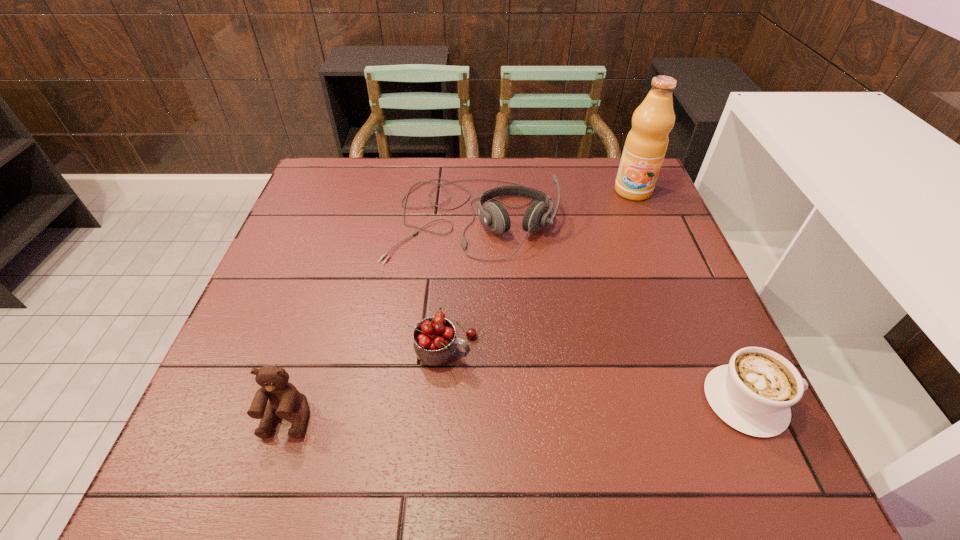
At what (x,y) coordinates should I click in order to perform the action: click on free space at the far right corner of the desktop. Please return your answer as a coordinate pair (x, y). Looking at the image, I should click on (611, 185).

Identify the location of free space at the near right corner of the desktop. The image size is (960, 540). (684, 388).

You are a GUI agent. You are given a task and a screenshot of the screen. Output one action in this format:
    pyautogui.click(x=<x>, y=<y>)
    Task: Click on the empty space between the headset and the leftmost object
    The image size is (960, 540).
    Given the screenshot: What is the action you would take?
    pyautogui.click(x=380, y=318)

Identify the location of vacant space in between the shortest object and the headset. The width and height of the screenshot is (960, 540). (610, 309).

Where is `empty space between the teddy bear and the shortest object`? empty space between the teddy bear and the shortest object is located at coordinates (517, 409).

At what (x,y) coordinates should I click in order to perform the action: click on unoccupied area between the headset and the teddy bear. Please return your answer as a coordinate pair (x, y). Looking at the image, I should click on (380, 318).

This screenshot has width=960, height=540. In order to click on unoccupied position between the teddy bear and the pot filled with cherries in this screenshot , I will do `click(366, 382)`.

This screenshot has height=540, width=960. In order to click on vacant area between the pot filled with cherries and the shortest object in this screenshot , I will do `click(596, 373)`.

The image size is (960, 540). Identify the location of unoccupied area between the leftmost object and the fruit juice. (460, 304).

Locate an element on the screen. This screenshot has width=960, height=540. free area in between the fruit juice and the cappuccino is located at coordinates (690, 296).